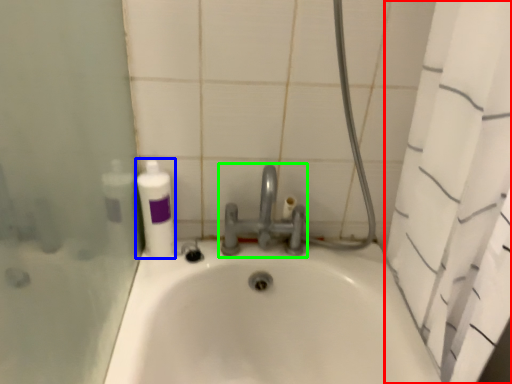
Question: Considering the real-world distances, which object is closest to shower curtain (highlighted by a red box)? cleaning product (highlighted by a blue box) or tap (highlighted by a green box).

Choices:
 (A) cleaning product
 (B) tap

Answer: (B)